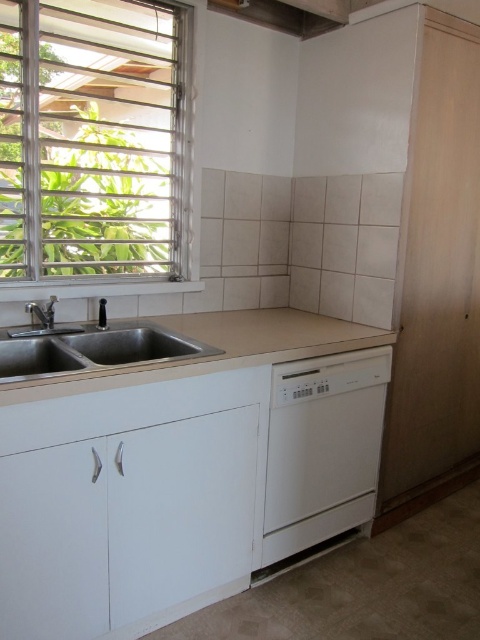
Question: Which object appears closest to the camera in this image?

Choices:
 (A) stainless steel sink at lower left
 (B) metallic/textured window at upper left

Answer: (A)

Question: Does metallic/textured window at upper left come in front of beige laminate countertop at center?

Choices:
 (A) yes
 (B) no

Answer: (B)

Question: Which point appears farthest from the camera in this image?

Choices:
 (A) (393, 339)
 (B) (52, 314)
 (C) (165, 339)
 (D) (183, 129)

Answer: (D)

Question: Does beige laminate countertop at center have a larger size compared to brushed metal faucet at left?

Choices:
 (A) yes
 (B) no

Answer: (A)

Question: Among these points, which one is farthest from the camera?

Choices:
 (A) click(339, 340)
 (B) click(117, 40)
 (C) click(105, 326)
 (D) click(50, 323)

Answer: (B)

Question: Considering the relative positions of white matte dishwasher at lower right and beige laminate countertop at center in the image provided, where is white matte dishwasher at lower right located with respect to beige laminate countertop at center?

Choices:
 (A) right
 (B) left

Answer: (A)